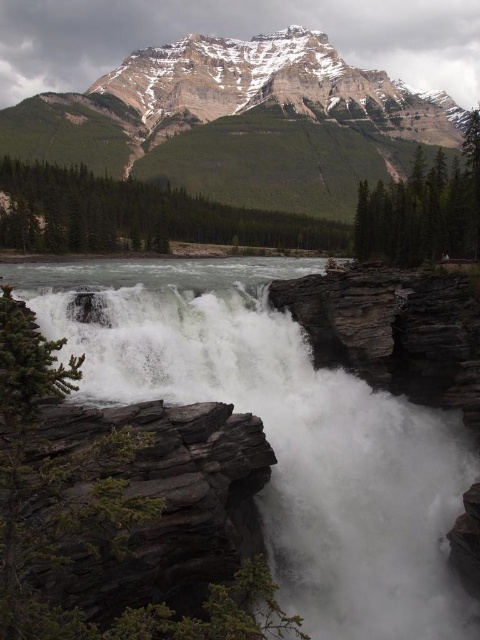
I want to click on snowy rocky mountain at upper center, so point(240,122).

Does snowy rocky mountain at upper center have a larger size compared to dark gray rock at lower left?

Correct, snowy rocky mountain at upper center is larger in size than dark gray rock at lower left.

Who is more forward, (349, 182) or (229, 486)?

Positioned in front is point (229, 486).

Locate an element on the screen. The image size is (480, 640). snowy rocky mountain at upper center is located at coordinates (240, 122).

Where is `white frothy water at center`? white frothy water at center is located at coordinates (287, 436).

Which is above, white frothy water at center or snowy rocky mountain at upper center?

Positioned higher is snowy rocky mountain at upper center.

Where is `white frothy water at center`? This screenshot has width=480, height=640. white frothy water at center is located at coordinates (287, 436).

Which is above, white frothy water at center or dark gray rock at lower left?

white frothy water at center

Describe the element at coordinates (287, 436) in the screenshot. I see `white frothy water at center` at that location.

Is point (252, 410) positioned behind point (132, 429)?

Yes.

Find the location of `white frothy water at center`. white frothy water at center is located at coordinates (287, 436).